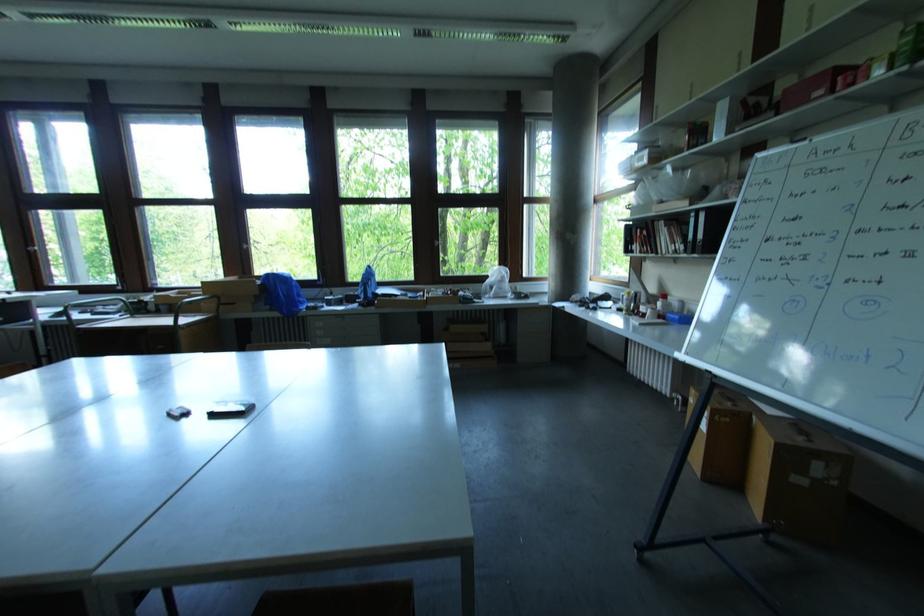
The width and height of the screenshot is (924, 616). Describe the element at coordinates (198, 305) in the screenshot. I see `a metal chair armrest` at that location.